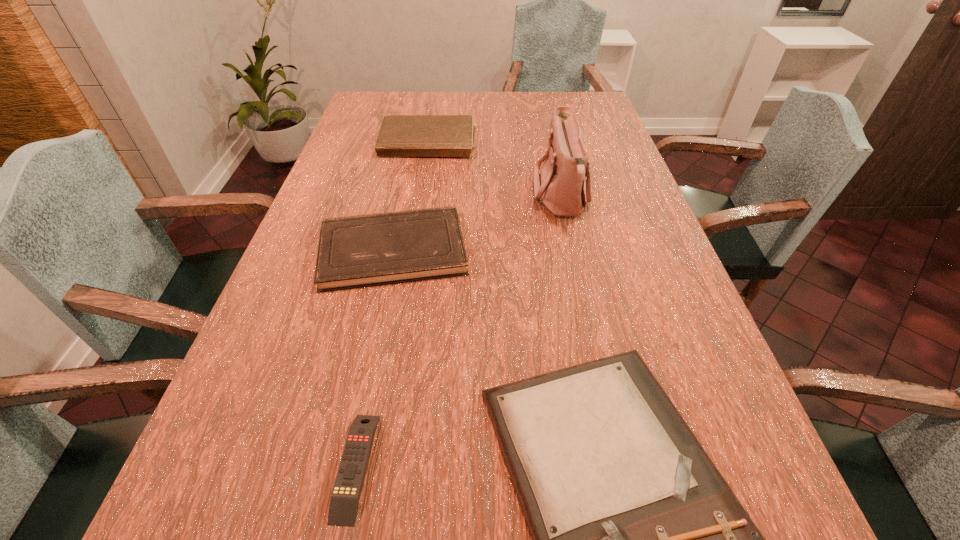
At what (x,y) coordinates should I click in order to perform the action: click on free space located 0.170m on the right of the third tallest object. Please return your answer as a coordinate pair (x, y). This screenshot has height=540, width=960. Looking at the image, I should click on (540, 250).

This screenshot has width=960, height=540. Identify the location of free space located on the back of the remote control. (372, 389).

Locate an element on the screen. The height and width of the screenshot is (540, 960). object situated at the right edge is located at coordinates tap(560, 187).

Where is `free space at the far edge of the desktop`? The height and width of the screenshot is (540, 960). free space at the far edge of the desktop is located at coordinates (491, 110).

Identify the location of vacant space at the left edge of the desktop. (262, 344).

Locate an element on the screen. The image size is (960, 540). vacant region at the right edge of the desktop is located at coordinates (661, 267).

At what (x,y) coordinates should I click in order to perform the action: click on blank space at the far left corner of the desktop. Please return your answer as a coordinate pair (x, y). The image size is (960, 540). Looking at the image, I should click on tap(403, 105).

Find the location of a particular element. free space between the third tallest object and the shoulder bag is located at coordinates (477, 224).

The height and width of the screenshot is (540, 960). Find the location of `free space between the remote control and the farther paperback book`. free space between the remote control and the farther paperback book is located at coordinates (393, 307).

The image size is (960, 540). I want to click on free spot between the remote control and the third shortest object, so (374, 358).